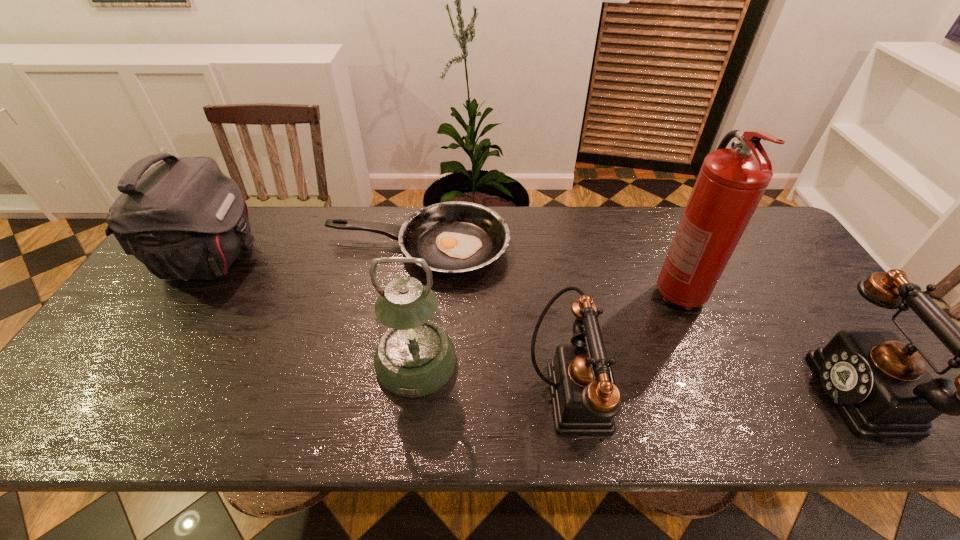
The image size is (960, 540). I want to click on free space located 0.160m on the open flap of the leftmost object, so click(x=312, y=260).

Where is `vacant region located on the left of the lantern`? This screenshot has width=960, height=540. vacant region located on the left of the lantern is located at coordinates (343, 362).

At what (x,y) coordinates should I click in order to perform the action: click on frying pan that is at the far edge. Please return your answer as a coordinate pair (x, y). The width and height of the screenshot is (960, 540). Looking at the image, I should click on (456, 237).

The image size is (960, 540). In order to click on shoulder bag that is at the far edge in this screenshot , I will do `click(184, 219)`.

At what (x,y) coordinates should I click in order to perform the action: click on telephone that is at the near edge. Please return your answer as a coordinate pair (x, y). Looking at the image, I should click on (584, 396).

Locate an element on the screen. This screenshot has height=540, width=960. lantern that is positioned at the near edge is located at coordinates (415, 357).

Where is `object that is at the left edge`? This screenshot has width=960, height=540. object that is at the left edge is located at coordinates (184, 219).

The width and height of the screenshot is (960, 540). What are the coordinates of `object at the far left corner` in the screenshot? It's located at (184, 219).

The height and width of the screenshot is (540, 960). What are the coordinates of `free location at the far edge` in the screenshot? It's located at (597, 252).

I want to click on free space at the near edge, so click(274, 367).